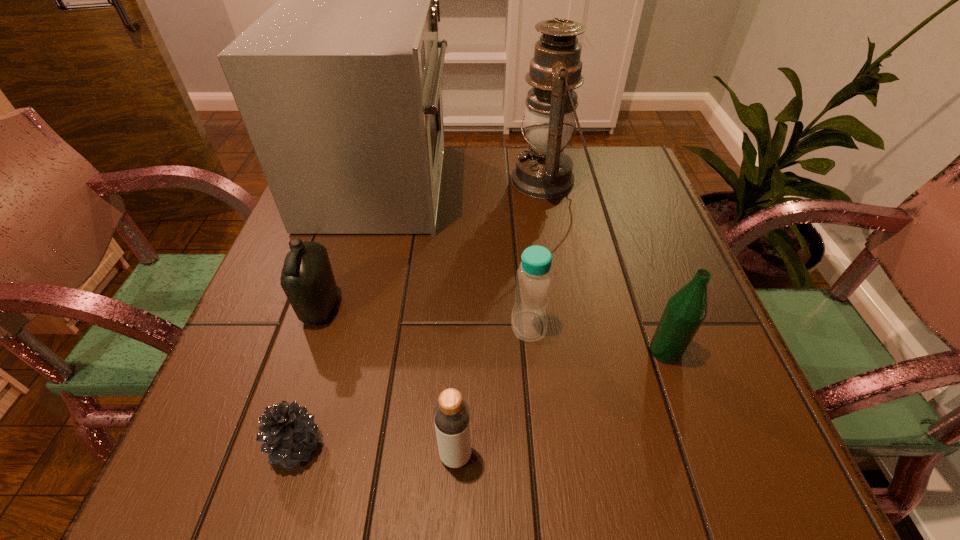
In order to click on bottle located in the left edge section of the desktop in this screenshot , I will do `click(307, 279)`.

At what (x,y) coordinates should I click in order to perform the action: click on pinecone that is at the left edge. Please return your answer as a coordinate pair (x, y). Looking at the image, I should click on (288, 431).

I want to click on object that is at the right edge, so click(x=685, y=311).

Where is `object at the far left corner`? The height and width of the screenshot is (540, 960). object at the far left corner is located at coordinates (338, 84).

Find the location of a particular element. object located at the near left corner is located at coordinates (288, 431).

Locate an element on the screen. This screenshot has width=960, height=540. free region at the far edge is located at coordinates (461, 178).

This screenshot has width=960, height=540. In the image, there is a desktop. Find the location of `vacant space at the near edge`. vacant space at the near edge is located at coordinates (439, 460).

In the image, there is a desktop. Where is `vacant space at the left edge`? vacant space at the left edge is located at coordinates (290, 388).

What are the coordinates of `free space at the right edge` in the screenshot? It's located at (683, 392).

Where is `free point between the toaster oven and the second bottle from left to right`? free point between the toaster oven and the second bottle from left to right is located at coordinates (419, 320).